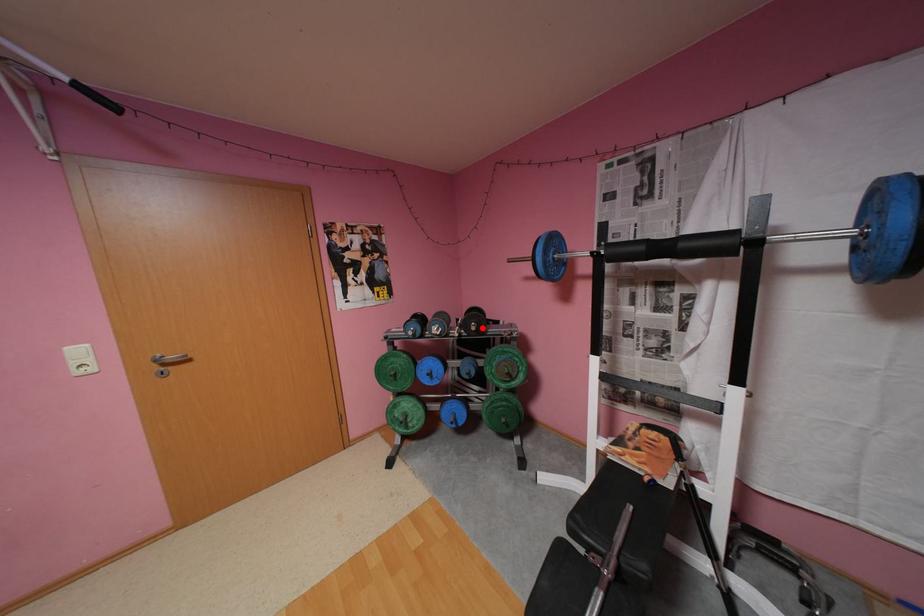
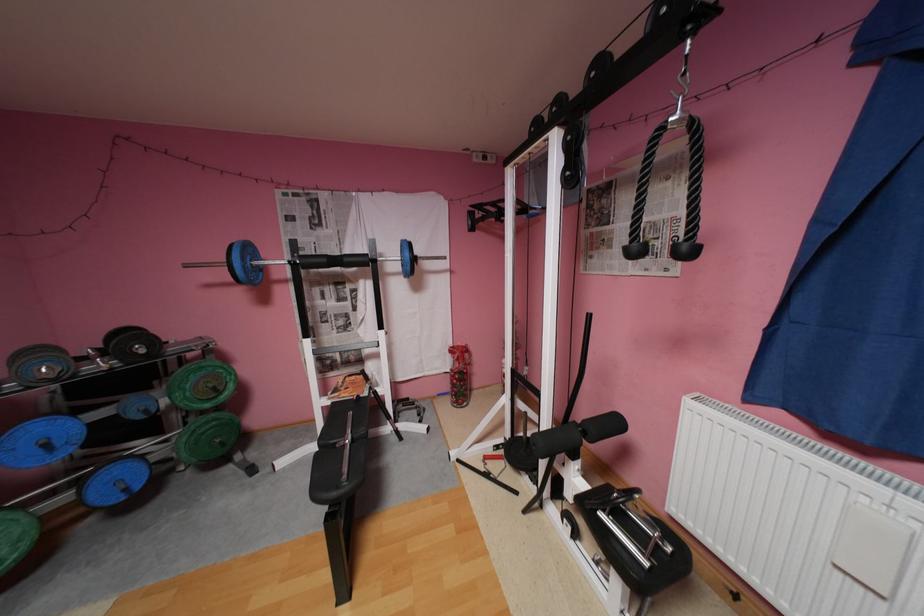
In the second image, find the point that corresponds to the highlighted location in the first image.

(152, 351)